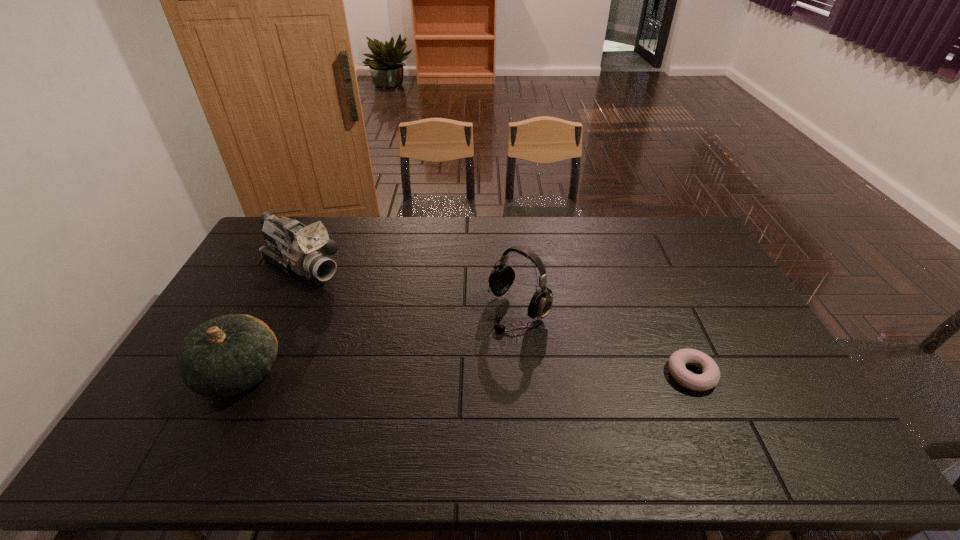
What are the coordinates of `vacant space that is in between the camcorder and the shortest object` in the screenshot? It's located at (496, 321).

You are a GUI agent. You are given a task and a screenshot of the screen. Output one action in this format:
    pyautogui.click(x=<x>, y=<y>)
    Task: Click on the free point between the camcorder and the doughnut
    
    Given the screenshot: What is the action you would take?
    pyautogui.click(x=496, y=321)

This screenshot has height=540, width=960. I want to click on free spot between the camcorder and the doughnut, so click(x=496, y=321).

What are the coordinates of `vacant space in between the gourd and the rightmost object` in the screenshot? It's located at (466, 374).

You are a GUI agent. You are given a task and a screenshot of the screen. Output one action in this format:
    pyautogui.click(x=<x>, y=<y>)
    Task: Click on the vacant area that lies between the third object from left to right and the gourd
    This screenshot has width=960, height=540.
    Given the screenshot: What is the action you would take?
    pyautogui.click(x=379, y=341)

Locate an element on the screen. The image size is (960, 540). free space that is in between the camcorder and the third object from left to right is located at coordinates (410, 288).

The width and height of the screenshot is (960, 540). Find the location of `object that stands as the third closest to the second object from right to left`. object that stands as the third closest to the second object from right to left is located at coordinates (225, 356).

Identify which object is the nearest to the headset. Please provide its 2D coordinates. Your answer should be formatted as a tuple, i.e. [(x, y)], where the tuple contains the x and y coordinates of a point satisfying the conditions above.

[(710, 376)]

In order to click on vacant space that satisfies the following two spatial constraints: 1. on the front side of the third object from left to right; 2. on the left side of the doughnut in this screenshot , I will do `click(524, 375)`.

Where is `vacant area that satisfies the following two spatial constraints: 1. on the back side of the gourd; 2. on the right side of the camcorder`? Image resolution: width=960 pixels, height=540 pixels. vacant area that satisfies the following two spatial constraints: 1. on the back side of the gourd; 2. on the right side of the camcorder is located at coordinates (293, 267).